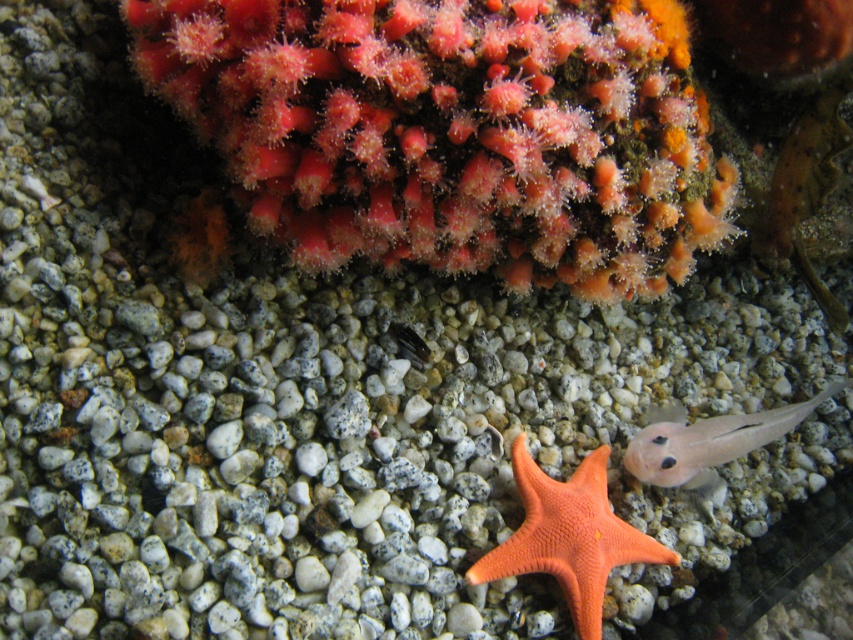
Question: Can you confirm if smooth coral at upper center is wider than translucent pink fish at lower right?

Choices:
 (A) no
 (B) yes

Answer: (B)

Question: Which point appears farthest from the camera in this image?

Choices:
 (A) (695, 470)
 (B) (527, 502)

Answer: (A)

Question: Can you confirm if smooth coral at upper center is thinner than translucent pink fish at lower right?

Choices:
 (A) yes
 (B) no

Answer: (B)

Question: Which point is closer to the camera?

Choices:
 (A) translucent pink fish at lower right
 (B) orange matte starfish at center
 (C) smooth coral at upper center

Answer: (C)

Question: Is orange matte starfish at center closer to camera compared to translucent pink fish at lower right?

Choices:
 (A) no
 (B) yes

Answer: (B)

Question: Estimate the real-world distances between objects in this image. Which object is farther from the orange matte starfish at center?

Choices:
 (A) translucent pink fish at lower right
 (B) smooth coral at upper center

Answer: (B)